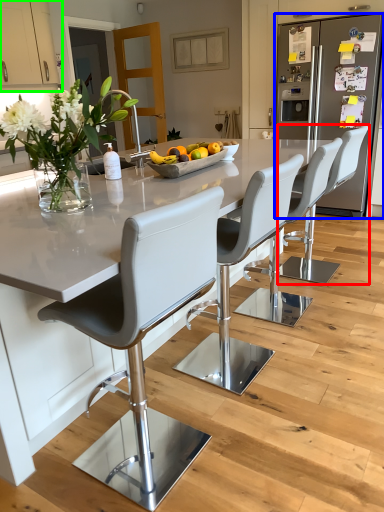
Question: Which object is positioned closest to chair (highlighted by a red box)? Select from fridge (highlighted by a blue box) and cabinetry (highlighted by a green box).

Choices:
 (A) fridge
 (B) cabinetry

Answer: (A)